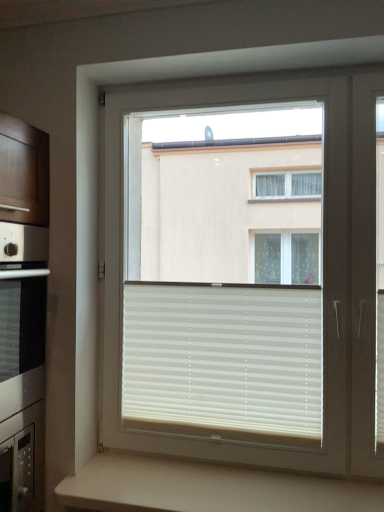
What are the coordinates of `vacant area on top of white plastic window at center (from a real-world perspective)` in the screenshot? It's located at (223, 76).